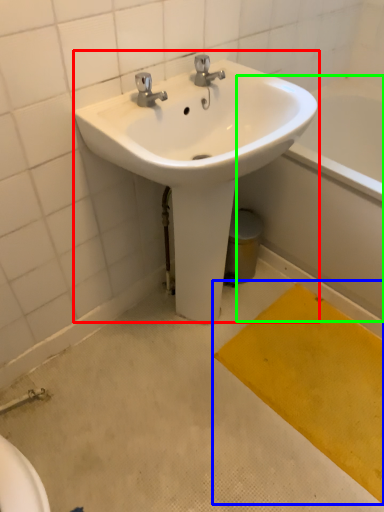
Question: Which is farther away from sink (highlighted by a red box)? doormat (highlighted by a blue box) or bath (highlighted by a green box)?

Choices:
 (A) doormat
 (B) bath

Answer: (A)